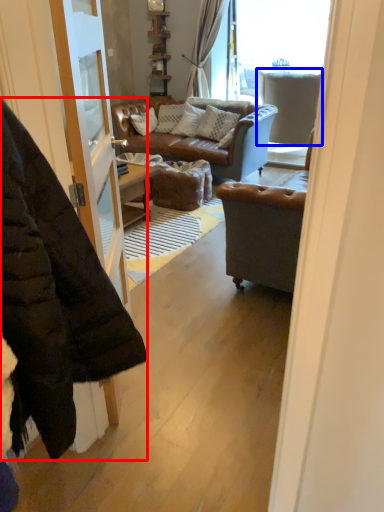
Question: Among these objects, which one is farthest to the camera, jacket (highlighted by a red box) or armchair (highlighted by a blue box)?

Choices:
 (A) jacket
 (B) armchair

Answer: (B)